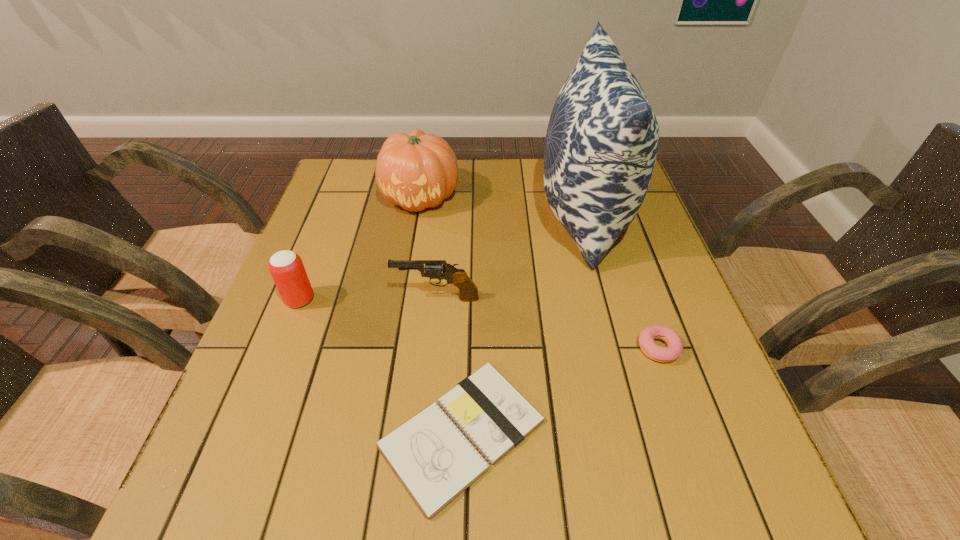
What are the coordinates of `free space located 0.250m on the right of the leftmost object` in the screenshot? It's located at (429, 300).

Locate an element on the screen. The image size is (960, 540). vacant space located 0.060m along the barrel of the gun is located at coordinates (368, 299).

The height and width of the screenshot is (540, 960). I want to click on blank space located along the barrel of the gun, so click(349, 299).

You are a GUI agent. You are given a task and a screenshot of the screen. Output one action in this format:
    pyautogui.click(x=<x>, y=<y>)
    Task: Click on the vacant position located along the barrel of the gun
    
    Given the screenshot: What is the action you would take?
    (372, 299)

Image resolution: width=960 pixels, height=540 pixels. I want to click on vacant space positioned 0.250m on the front of the second shortest object, so click(x=712, y=505).

Image resolution: width=960 pixels, height=540 pixels. What are the coordinates of `vacant point located on the right of the shortest object` in the screenshot? It's located at point(598,433).

What are the coordinates of `cushion that is positioned at the far edge` in the screenshot? It's located at (602, 140).

Find the location of a particular element. This screenshot has height=540, width=960. pumpkin at the far edge is located at coordinates (417, 170).

This screenshot has width=960, height=540. Identify the location of object situated at the near edge. (435, 462).

Locate an element on the screen. The height and width of the screenshot is (540, 960). object that is at the left edge is located at coordinates (286, 267).